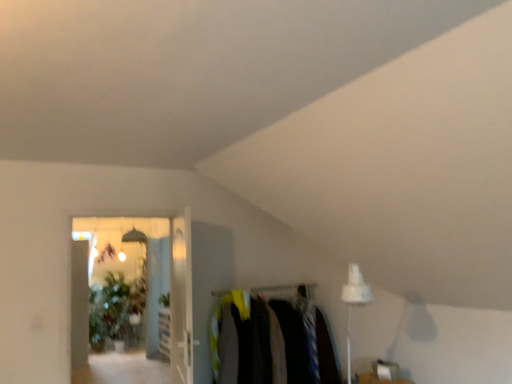
What do you see at coordinates (139, 275) in the screenshot?
I see `transparent glass door at center, acting as the first glass door starting from the left` at bounding box center [139, 275].

Describe the element at coordinates (181, 299) in the screenshot. This screenshot has height=384, width=512. I see `clear glass door at center, the second glass door from the left` at that location.

In order to face green leafy plant at upper center, should I rotate leftwards or rightwards?

To face it directly, rotate left by 11.863 degrees.

Locate an element on the screen. Image resolution: width=512 pixels, height=384 pixels. transparent glass door at center, acting as the first glass door starting from the left is located at coordinates (139, 275).

What's the angular difference between clear glass door at center, which ranks as the first glass door in right-to-left order, and transparent glass door at center, acting as the 2th glass door starting from the right,'s facing directions?

They differ by 103 degrees in their facing directions.

Which object is positioned more to the left, clear glass door at center, the second glass door from the left, or transparent glass door at center, acting as the 2th glass door starting from the right?

transparent glass door at center, acting as the 2th glass door starting from the right, is more to the left.

Is clear glass door at center, the second glass door from the left, far from transparent glass door at center, acting as the first glass door starting from the left?

Yes, clear glass door at center, the second glass door from the left, is far from transparent glass door at center, acting as the first glass door starting from the left.

Which point is more distant from viewer, [190,289] or [167,279]?

The point [167,279] is more distant.

Is dark fabric clothes at center bigger than green leafy plant at upper center?

Correct, dark fabric clothes at center is larger in size than green leafy plant at upper center.

Which object is positioned more to the right, dark fabric clothes at center or green leafy plant at upper center?

From the viewer's perspective, dark fabric clothes at center appears more on the right side.

You are a GUI agent. You are given a task and a screenshot of the screen. Output one action in this format:
    pyautogui.click(x=<x>, y=<y>)
    Task: Click on the closet that appears on the right of green leafy plant at upper center
    This screenshot has width=512, height=384.
    Given the screenshot: What is the action you would take?
    pyautogui.click(x=270, y=341)

Between dark fabric clothes at center and transparent glass door at center, acting as the 2th glass door starting from the right, which one has larger size?

With larger size is transparent glass door at center, acting as the 2th glass door starting from the right.

You are a GUI agent. You are given a task and a screenshot of the screen. Output one action in this format:
    pyautogui.click(x=<x>, y=<y>)
    Task: Click on the closet behind the transparent glass door at center, acting as the first glass door starting from the left
    
    Given the screenshot: What is the action you would take?
    pyautogui.click(x=270, y=341)

Considering the sizes of objects dark fabric clothes at center and transparent glass door at center, acting as the first glass door starting from the left, in the image provided, who is wider, dark fabric clothes at center or transparent glass door at center, acting as the first glass door starting from the left,?

With larger width is dark fabric clothes at center.

Considering the sizes of objects transparent glass door at center, acting as the 2th glass door starting from the right, and green leafy plant at upper center in the image provided, who is smaller, transparent glass door at center, acting as the 2th glass door starting from the right, or green leafy plant at upper center?

green leafy plant at upper center is smaller.

Considering the sizes of transparent glass door at center, acting as the 2th glass door starting from the right, and green leafy plant at upper center in the image, is transparent glass door at center, acting as the 2th glass door starting from the right, taller or shorter than green leafy plant at upper center?

Clearly, transparent glass door at center, acting as the 2th glass door starting from the right, is taller compared to green leafy plant at upper center.

Is transparent glass door at center, acting as the 2th glass door starting from the right, outside of green leafy plant at upper center?

Yes.

From the image's perspective, who appears lower, transparent glass door at center, acting as the 2th glass door starting from the right, or green leafy plant at upper center?

green leafy plant at upper center, from the image's perspective.

From a real-world perspective, is clear glass door at center, the second glass door from the left, physically located above or below green leafy plant at upper center?

clear glass door at center, the second glass door from the left, is above green leafy plant at upper center.

Who is shorter, clear glass door at center, the second glass door from the left, or green leafy plant at upper center?

green leafy plant at upper center is shorter.

Is clear glass door at center, the second glass door from the left, facing towards green leafy plant at upper center?

No, clear glass door at center, the second glass door from the left, is not facing towards green leafy plant at upper center.

From the picture: Is clear glass door at center, the second glass door from the left, in contact with green leafy plant at upper center?

clear glass door at center, the second glass door from the left, and green leafy plant at upper center are not in contact.

From the picture: Measure the distance between clear glass door at center, which ranks as the first glass door in right-to-left order, and dark fabric clothes at center.

clear glass door at center, which ranks as the first glass door in right-to-left order, is 67.07 centimeters from dark fabric clothes at center.

Which of these two, clear glass door at center, the second glass door from the left, or dark fabric clothes at center, is thinner?

With smaller width is clear glass door at center, the second glass door from the left.

From the image's perspective, count 2nd glass doors upward from the dark fabric clothes at center and point to it. Please provide its 2D coordinates.

[(181, 299)]

From their relative heights in the image, would you say clear glass door at center, the second glass door from the left, is taller or shorter than dark fabric clothes at center?

In the image, clear glass door at center, the second glass door from the left, appears to be taller than dark fabric clothes at center.

Which object is positioned more to the right, transparent glass door at center, acting as the 2th glass door starting from the right, or clear glass door at center, which ranks as the first glass door in right-to-left order?

clear glass door at center, which ranks as the first glass door in right-to-left order, is more to the right.

Is transparent glass door at center, acting as the 2th glass door starting from the right, positioned behind clear glass door at center, which ranks as the first glass door in right-to-left order?

Yes, transparent glass door at center, acting as the 2th glass door starting from the right, is further from the camera.

Can you confirm if transparent glass door at center, acting as the first glass door starting from the left, is bigger than clear glass door at center, the second glass door from the left?

Yes.

From the image's perspective, is transparent glass door at center, acting as the 2th glass door starting from the right, located beneath clear glass door at center, the second glass door from the left?

Correct, transparent glass door at center, acting as the 2th glass door starting from the right, appears lower than clear glass door at center, the second glass door from the left, in the image.

This screenshot has height=384, width=512. Identify the location of glass door above the clear glass door at center, the second glass door from the left (from a real-world perspective). (139, 275).

In the image, there is a dark fabric clothes at center. In order to click on plant below it (from the image's perspective) in this screenshot , I will do `click(164, 300)`.

Estimate the real-world distances between objects in this image. Which object is closer to clear glass door at center, which ranks as the first glass door in right-to-left order, green leafy plant at upper center or transparent glass door at center, acting as the 2th glass door starting from the right?

green leafy plant at upper center is positioned closer to the anchor clear glass door at center, which ranks as the first glass door in right-to-left order.

Considering their positions, is green leafy plant at upper center positioned closer to transparent glass door at center, acting as the first glass door starting from the left, than clear glass door at center, which ranks as the first glass door in right-to-left order?

The object closer to transparent glass door at center, acting as the first glass door starting from the left, is green leafy plant at upper center.

Considering their positions, is clear glass door at center, which ranks as the first glass door in right-to-left order, positioned closer to transparent glass door at center, acting as the first glass door starting from the left, than dark fabric clothes at center?

The object closer to transparent glass door at center, acting as the first glass door starting from the left, is clear glass door at center, which ranks as the first glass door in right-to-left order.

From the image, which object appears to be nearer to dark fabric clothes at center, clear glass door at center, which ranks as the first glass door in right-to-left order, or transparent glass door at center, acting as the first glass door starting from the left?

The object closer to dark fabric clothes at center is clear glass door at center, which ranks as the first glass door in right-to-left order.

From the image, which object appears to be nearer to transparent glass door at center, acting as the 2th glass door starting from the right, green leafy plant at upper center or dark fabric clothes at center?

green leafy plant at upper center lies closer to transparent glass door at center, acting as the 2th glass door starting from the right, than the other object.

When comparing their distances from transparent glass door at center, acting as the 2th glass door starting from the right, does dark fabric clothes at center or clear glass door at center, which ranks as the first glass door in right-to-left order, seem further?

dark fabric clothes at center is further to transparent glass door at center, acting as the 2th glass door starting from the right.

Estimate the real-world distances between objects in this image. Which object is further from green leafy plant at upper center, dark fabric clothes at center or clear glass door at center, which ranks as the first glass door in right-to-left order?

dark fabric clothes at center is positioned further to the anchor green leafy plant at upper center.

Based on their spatial positions, is transparent glass door at center, acting as the 2th glass door starting from the right, or dark fabric clothes at center closer to green leafy plant at upper center?

dark fabric clothes at center.

This screenshot has height=384, width=512. Identify the location of glass door between clear glass door at center, the second glass door from the left, and green leafy plant at upper center from front to back. (139, 275).

This screenshot has height=384, width=512. I want to click on closet positioned between transparent glass door at center, acting as the first glass door starting from the left, and green leafy plant at upper center from near to far, so click(270, 341).

Identify the location of glass door located between transparent glass door at center, acting as the 2th glass door starting from the right, and dark fabric clothes at center in the left-right direction. The image size is (512, 384). (181, 299).

You are a GUI agent. You are given a task and a screenshot of the screen. Output one action in this format:
    pyautogui.click(x=<x>, y=<y>)
    Task: Click on the closet between clear glass door at center, the second glass door from the left, and green leafy plant at upper center, along the z-axis
    The image size is (512, 384).
    Given the screenshot: What is the action you would take?
    pyautogui.click(x=270, y=341)